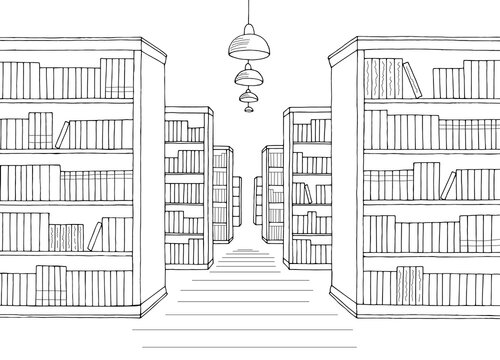
You are a GUI agent. You are given a task and a screenshot of the screen. Output one action in this format:
    pyautogui.click(x=<x>, y=<y>)
    Task: Click on the book shelves
    
    Given the screenshot: What is the action you would take?
    pyautogui.click(x=147, y=127), pyautogui.click(x=206, y=118), pyautogui.click(x=230, y=159), pyautogui.click(x=238, y=196), pyautogui.click(x=259, y=194), pyautogui.click(x=267, y=154), pyautogui.click(x=292, y=118), pyautogui.click(x=350, y=81)